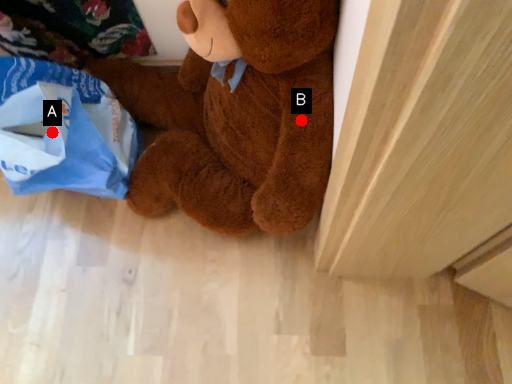
Question: Two points are circled on the image, labeled by A and B beside each circle. Which point is farther to the camera?

Choices:
 (A) A is further
 (B) B is further

Answer: (A)